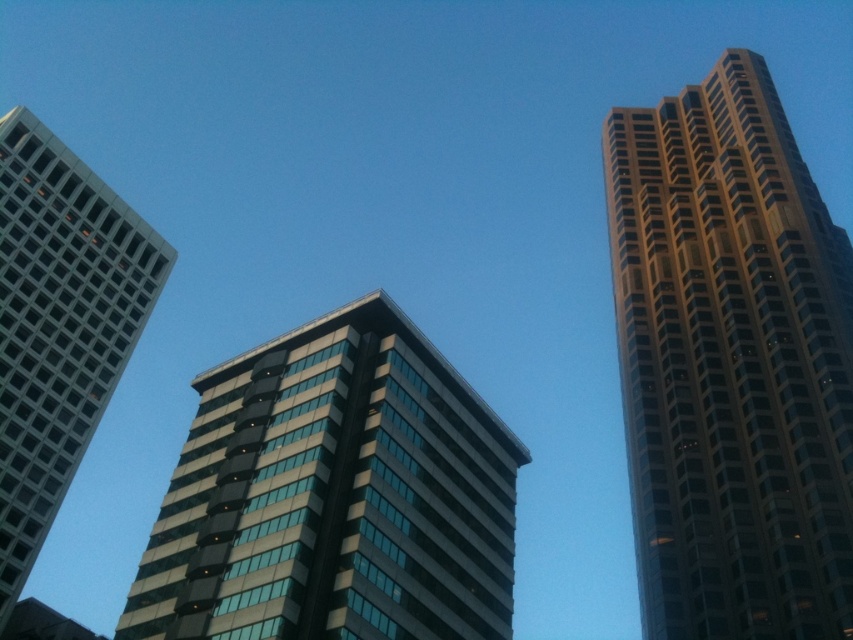
Is point (268, 358) behind point (80, 196)?

No, it is not.

Which is more to the left, glassy reflective building at center or matte glass skyscraper at left?

Positioned to the left is matte glass skyscraper at left.

Is point (308, 433) closer to viewer compared to point (97, 396)?

Yes, it is.

Find the location of a particular element. The height and width of the screenshot is (640, 853). glassy reflective building at center is located at coordinates (334, 496).

Who is lower down, gold glassy building at right or glassy reflective building at center?

glassy reflective building at center is lower down.

Measure the distance from gold glassy building at right to glassy reflective building at center.

They are 122.00 feet apart.

I want to click on gold glassy building at right, so click(730, 364).

This screenshot has height=640, width=853. Find the location of `gold glassy building at right`. gold glassy building at right is located at coordinates (730, 364).

Does gold glassy building at right have a lesser height compared to matte glass skyscraper at left?

Incorrect, gold glassy building at right's height does not fall short of matte glass skyscraper at left's.

From the picture: Does gold glassy building at right have a greater width compared to matte glass skyscraper at left?

Correct, the width of gold glassy building at right exceeds that of matte glass skyscraper at left.

In order to click on gold glassy building at right in this screenshot , I will do `click(730, 364)`.